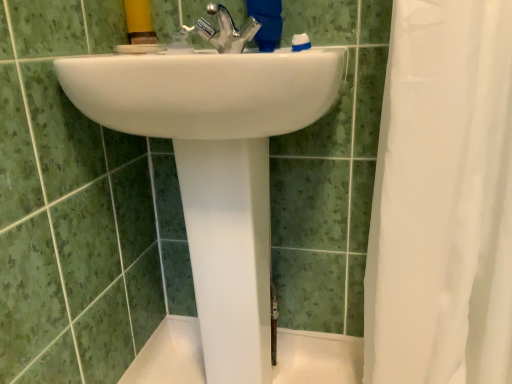
Question: Is white sheer fabric at right bigger than white glossy sink at center?

Choices:
 (A) no
 (B) yes

Answer: (A)

Question: From the image's perspective, is white sheer fabric at right on top of white glossy sink at center?

Choices:
 (A) no
 (B) yes

Answer: (B)

Question: Is white sheer fabric at right shorter than white glossy sink at center?

Choices:
 (A) yes
 (B) no

Answer: (B)

Question: Is white sheer fabric at right looking in the opposite direction of white glossy sink at center?

Choices:
 (A) yes
 (B) no

Answer: (B)

Question: Is white sheer fabric at right at the right side of white glossy sink at center?

Choices:
 (A) yes
 (B) no

Answer: (A)

Question: Based on their positions, is white glossy sink at center located to the left or right of polished chrome faucet at center?

Choices:
 (A) right
 (B) left

Answer: (B)

Question: Considering the positions of white glossy sink at center and polished chrome faucet at center in the image, is white glossy sink at center bigger or smaller than polished chrome faucet at center?

Choices:
 (A) big
 (B) small

Answer: (A)

Question: From a real-world perspective, relative to polished chrome faucet at center, is white glossy sink at center vertically above or below?

Choices:
 (A) below
 (B) above

Answer: (A)

Question: Considering the positions of white glossy sink at center and polished chrome faucet at center in the image, is white glossy sink at center taller or shorter than polished chrome faucet at center?

Choices:
 (A) short
 (B) tall

Answer: (B)

Question: Does point (265, 158) appear closer or farther from the camera than point (484, 51)?

Choices:
 (A) closer
 (B) farther

Answer: (B)

Question: From the image's perspective, is white glossy sink at center located above or below white sheer fabric at right?

Choices:
 (A) above
 (B) below

Answer: (B)

Question: Considering their positions, is white glossy sink at center located in front of or behind white sheer fabric at right?

Choices:
 (A) behind
 (B) front

Answer: (A)

Question: Is white glossy sink at center taller or shorter than white sheer fabric at right?

Choices:
 (A) short
 (B) tall

Answer: (A)

Question: Do you think polished chrome faucet at center is within white sheer fabric at right, or outside of it?

Choices:
 (A) outside
 (B) inside

Answer: (A)

Question: Considering their positions, is polished chrome faucet at center located in front of or behind white sheer fabric at right?

Choices:
 (A) behind
 (B) front

Answer: (A)